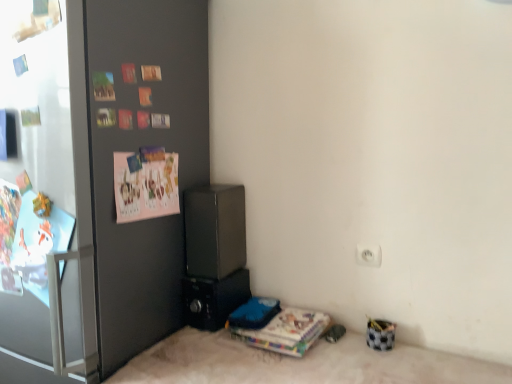
I want to click on free space above multicolored paper stack at lower center (from a real-world perspective), so click(287, 319).